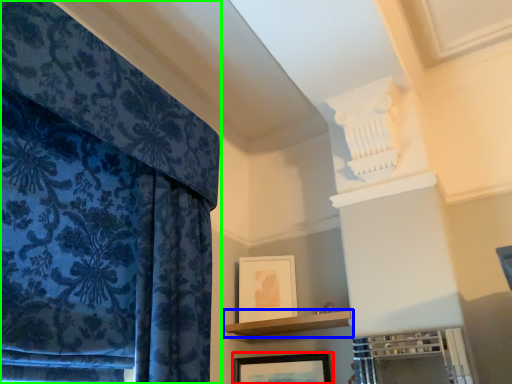
Question: Estimate the real-world distances between objects in this image. Which object is farther from picture frame (highlighted by a red box), shelf (highlighted by a blue box) or curtain (highlighted by a green box)?

Choices:
 (A) shelf
 (B) curtain

Answer: (B)